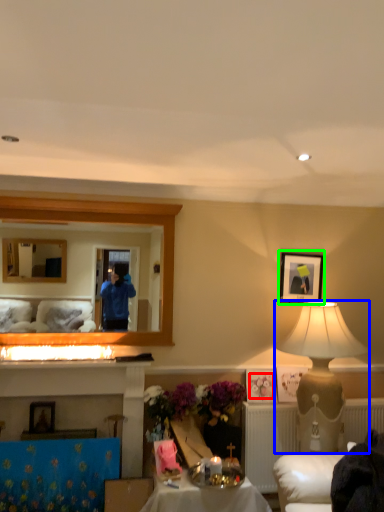
Question: Considering the real-world distances, which object is closest to flower (highlighted by a red box)? table lamp (highlighted by a blue box) or picture frame (highlighted by a green box).

Choices:
 (A) table lamp
 (B) picture frame

Answer: (A)